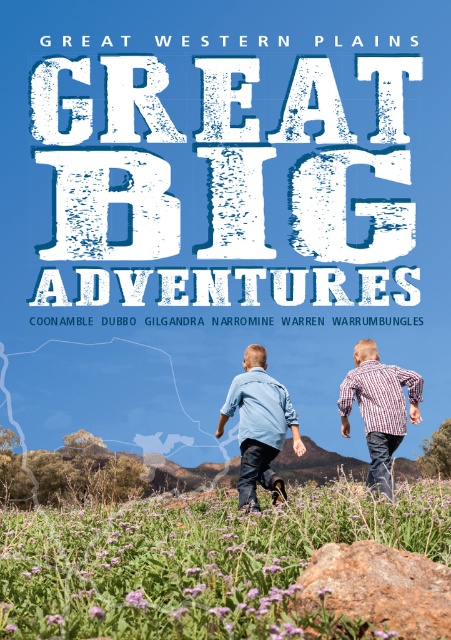
Based on the photo, who is positioned more to the left, brown rough rock at center or striped cotton shirt at center?

brown rough rock at center

Where is `brown rough rock at center`? The height and width of the screenshot is (640, 451). brown rough rock at center is located at coordinates (380, 588).

Is purple soft-textured flowers at center positioned behind denim shirt at center?

That is False.

Does point (180, 586) come in front of point (216, 435)?

Yes, point (180, 586) is closer to viewer.

I want to click on purple soft-textured flowers at center, so click(x=197, y=561).

Is denim shirt at center smaller than striped cotton shirt at center?

Incorrect, denim shirt at center is not smaller in size than striped cotton shirt at center.

Is point (261, 369) positioned in front of point (351, 369)?

That is True.

Locate an element on the screen. Image resolution: width=451 pixels, height=640 pixels. denim shirt at center is located at coordinates (259, 426).